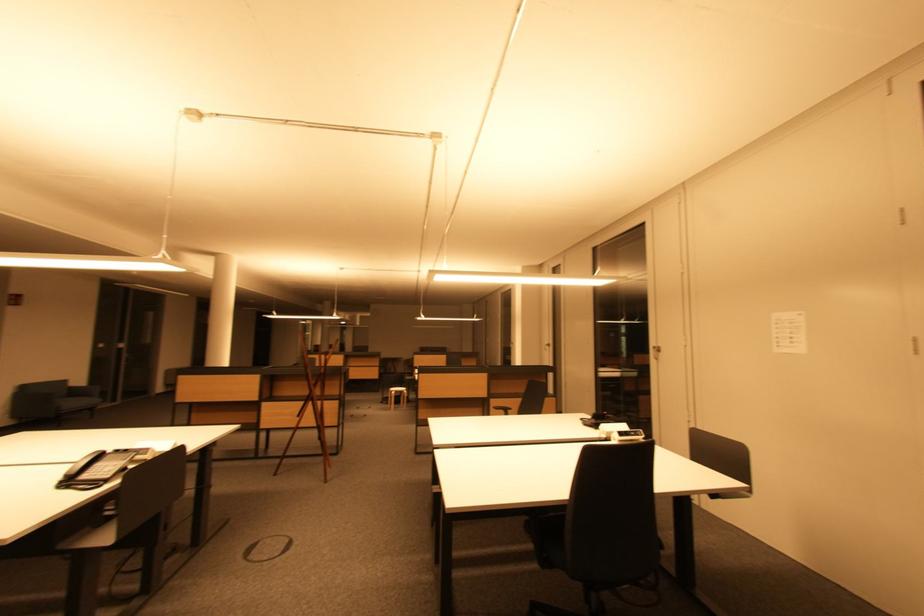
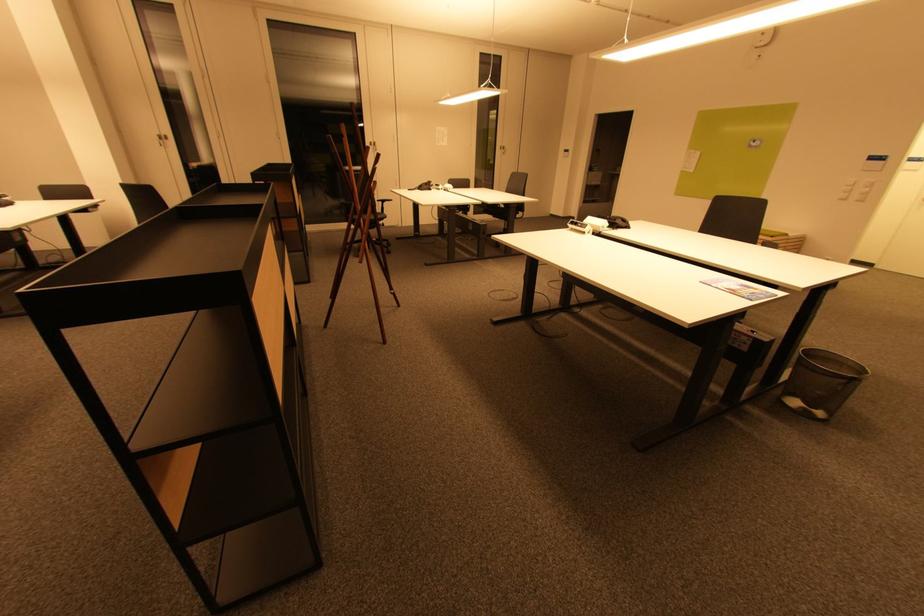
Locate, in the second image, the point that corresponds to point (553, 347) in the first image.

(166, 140)